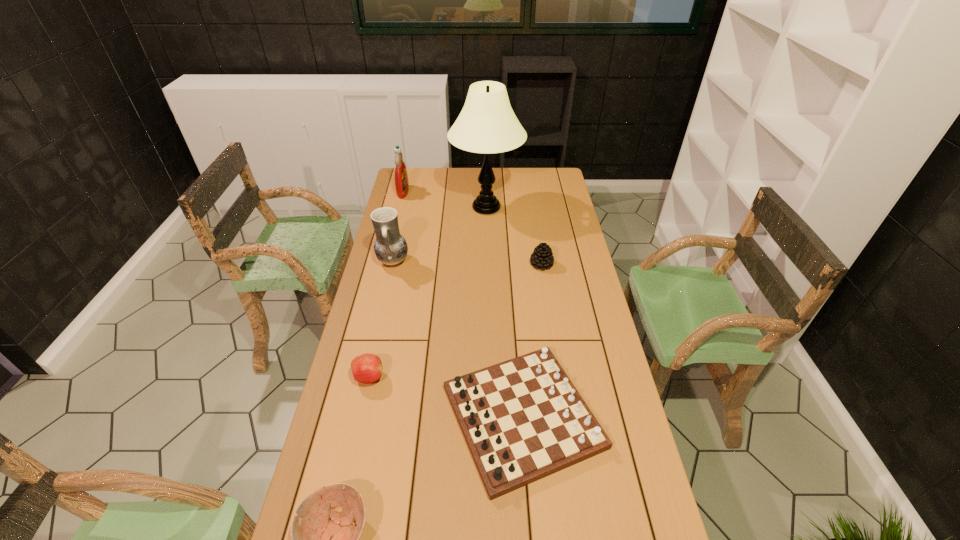
In order to click on object that is the fourth closest to the bowl in this screenshot , I will do `click(542, 257)`.

At what (x,y) coordinates should I click in order to perform the action: click on free point that satisfies the following two spatial constraints: 1. on the front surface of the detergent; 2. on the left side of the pottery. Please return your answer as a coordinate pair (x, y). Looking at the image, I should click on (386, 261).

Locate an element on the screen. free spot that satisfies the following two spatial constraints: 1. on the back side of the pottery; 2. on the front surface of the detergent is located at coordinates (409, 192).

I want to click on vacant point that satisfies the following two spatial constraints: 1. on the back side of the tallest object; 2. on the front surface of the detergent, so click(x=486, y=192).